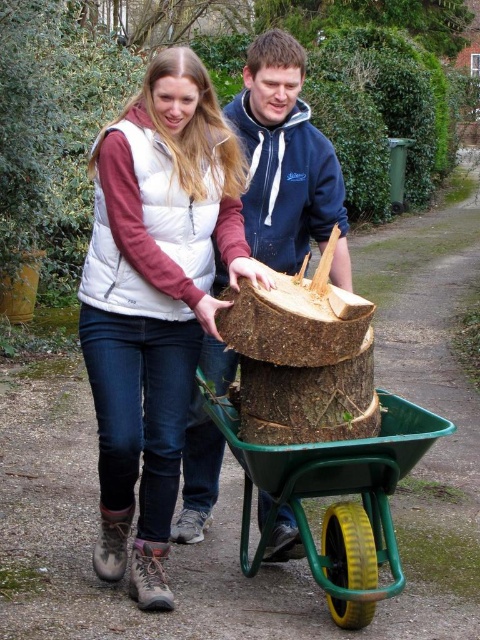
Can you confirm if blue fleece jacket at center is smaller than green plastic cart at center?

Yes, blue fleece jacket at center is smaller than green plastic cart at center.

Which is behind, point (269, 93) or point (347, 483)?

Point (269, 93)

Is point (262, 516) farther from viewer compared to point (402, 465)?

Yes, point (262, 516) is farther from viewer.

Locate an element on the screen. blue fleece jacket at center is located at coordinates (287, 163).

Does white fleece vest at upper left have a greater width compared to green plastic cart at center?

No, white fleece vest at upper left is not wider than green plastic cart at center.

Does white fleece vest at upper left have a greater height compared to green plastic cart at center?

Correct, white fleece vest at upper left is much taller as green plastic cart at center.

Who is more distant from viewer, (129, 451) or (339, 552)?

Point (129, 451)

Where is `white fleece vest at upper left`? white fleece vest at upper left is located at coordinates (155, 298).

Between white fleece vest at upper left and blue fleece jacket at center, which one has less height?

blue fleece jacket at center is shorter.

Can you confirm if white fleece vest at upper left is positioned below blue fleece jacket at center?

Correct, white fleece vest at upper left is located below blue fleece jacket at center.

Between point (210, 109) and point (242, 134), which one is positioned in front?

Point (210, 109)

The width and height of the screenshot is (480, 640). I want to click on white fleece vest at upper left, so click(x=155, y=298).